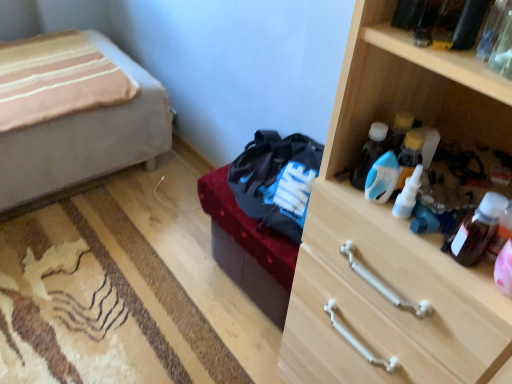
Question: From the image's perspective, relative to translucent plastic bottle at upper right, which is the 3th bottle in right-to-left order, is blue plastic bottle at center right, placed as the 4th bottle when sorted from right to left, above or below?

Choices:
 (A) below
 (B) above

Answer: (B)

Question: From a real-world perspective, is blue plastic bottle at center right, placed as the 4th bottle when sorted from right to left, positioned above or below translucent plastic bottle at upper right, which is the 3th bottle in right-to-left order?

Choices:
 (A) above
 (B) below

Answer: (A)

Question: Which object is positioned farthest from the blue glossy bottle at upper right, positioned as the 5th bottle in right-to-left order?

Choices:
 (A) translucent plastic bottle at upper right, which is the 3th bottle in right-to-left order
 (B) translucent plastic bottle at upper right, the 5th bottle in the left-to-right sequence
 (C) white plastic bottle at upper right, positioned as the second bottle in right-to-left order
 (D) blue plastic bottle at center right, the second bottle in the left-to-right sequence
 (E) beige fabric bed at left

Answer: (E)

Question: Based on their relative distances, which object is nearer to the dark brown leather bed frame at center?

Choices:
 (A) white plastic bottle at upper right, positioned as the second bottle in right-to-left order
 (B) blue glossy bottle at upper right, acting as the first bottle starting from the left
 (C) beige fabric bed at left
 (D) blue plastic bottle at center right, placed as the 4th bottle when sorted from right to left
 (E) translucent plastic bottle at upper right, which is the 3th bottle in left-to-right order

Answer: (B)